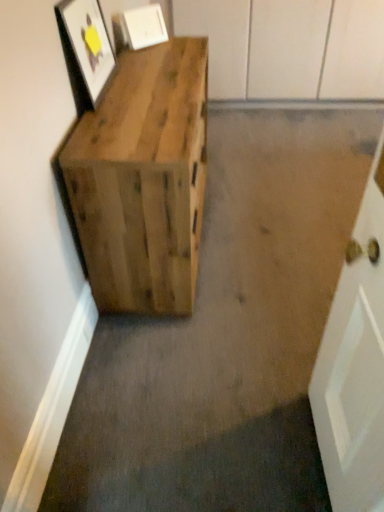
Locate an element on the screen. free spot in front of matte white picture frame at upper center, the first picture frame viewed from the back is located at coordinates (150, 53).